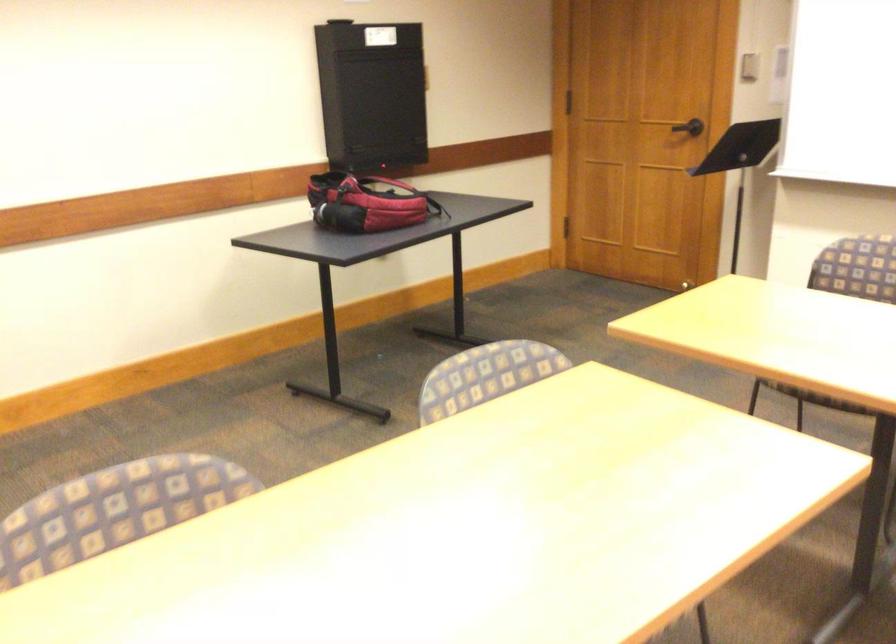
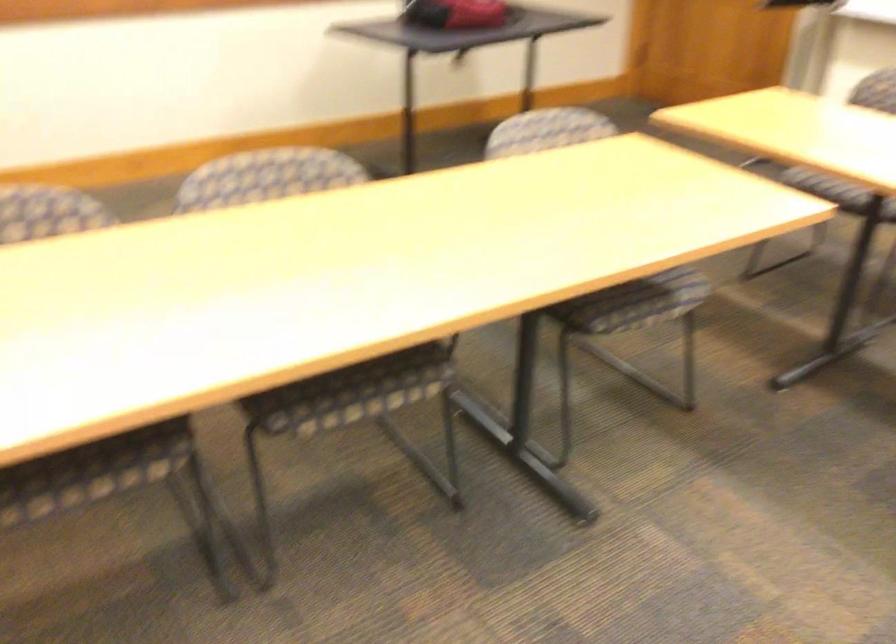
Where in the second image is the point corresponding to point 364,220 from the first image?

(455, 13)